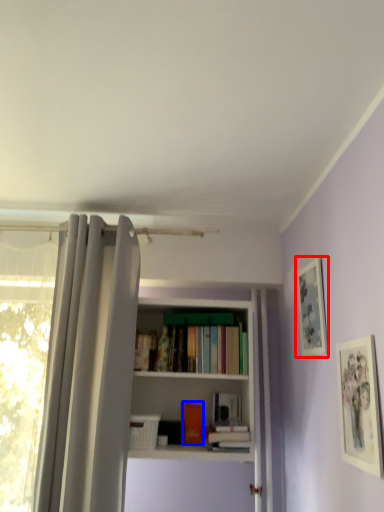
Question: Which of the following is the farthest to the observer, picture frame (highlighted by a red box) or book (highlighted by a blue box)?

Choices:
 (A) picture frame
 (B) book

Answer: (B)